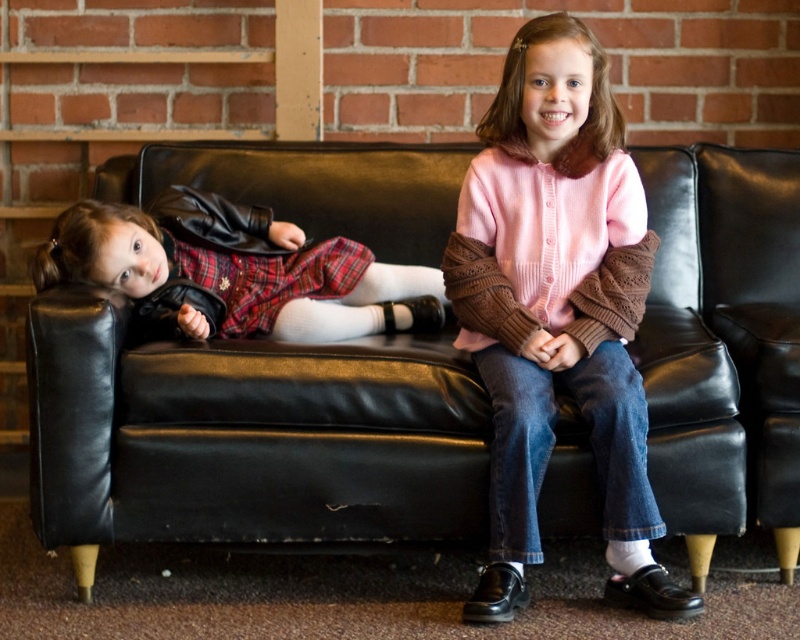
You are a photographer setting up for a family photo. You need to position a tripod between the black leather couch at center and the pink knitted sweater at center. Since the couch is closer to you, where should you place the tripod to ensure it is between both objects?

The black leather couch at center is closer to you than the pink knitted sweater at center. To place the tripod between them, set it closer to the couch but still in front of the sweater.